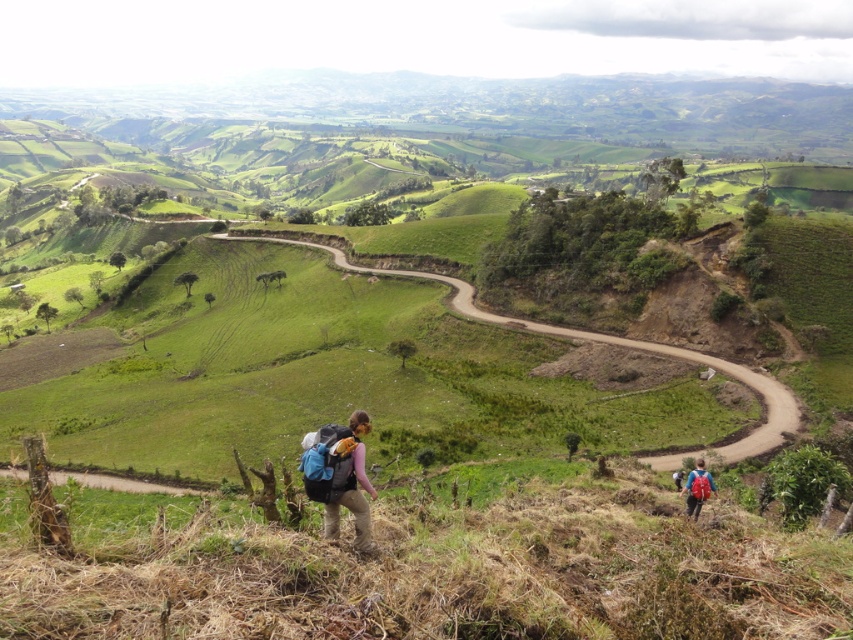
Does matte blue backpack at center have a lesser height compared to matte blue backpack at lower right?

No.

Which of these two, matte blue backpack at center or matte blue backpack at lower right, stands shorter?

matte blue backpack at lower right is shorter.

This screenshot has height=640, width=853. Find the location of `matte blue backpack at center`. matte blue backpack at center is located at coordinates (343, 477).